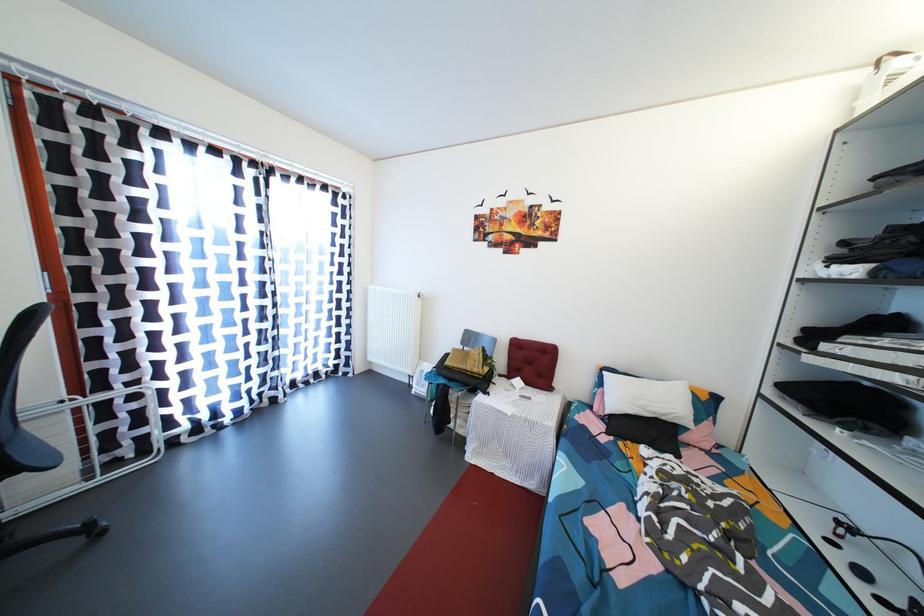
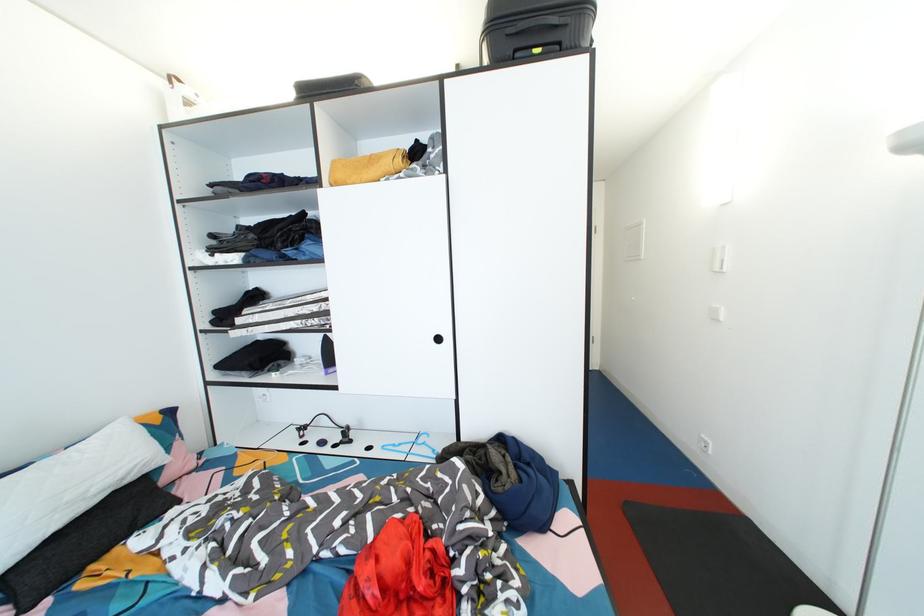
Question: The first image is from the beginning of the video and the second image is from the end. How did the camera likely rotate when shooting the video?

Choices:
 (A) Left
 (B) Right
 (C) Up
 (D) Down

Answer: (B)